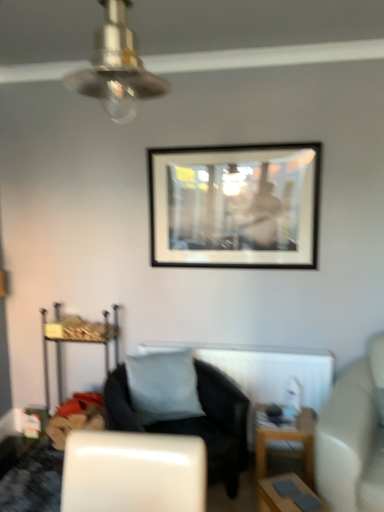
Question: Considering the relative sizes of metallic silver ceiling fan at upper center and black fabric chair at center in the image provided, is metallic silver ceiling fan at upper center shorter than black fabric chair at center?

Choices:
 (A) yes
 (B) no

Answer: (A)

Question: From a real-world perspective, is metallic silver ceiling fan at upper center physically above black fabric chair at center?

Choices:
 (A) yes
 (B) no

Answer: (A)

Question: Does metallic silver ceiling fan at upper center appear on the right side of black fabric chair at center?

Choices:
 (A) yes
 (B) no

Answer: (B)

Question: Does metallic silver ceiling fan at upper center have a lesser width compared to black fabric chair at center?

Choices:
 (A) no
 (B) yes

Answer: (B)

Question: Can black fabric chair at center be found inside metallic silver ceiling fan at upper center?

Choices:
 (A) no
 (B) yes

Answer: (A)

Question: In the image, is smooth wooden table at lower right, the second table when ordered from back to front, on the left side or the right side of black fabric chair at center?

Choices:
 (A) left
 (B) right

Answer: (B)

Question: From their relative heights in the image, would you say smooth wooden table at lower right, the 1th table in the front-to-back sequence, is taller or shorter than black fabric chair at center?

Choices:
 (A) short
 (B) tall

Answer: (A)

Question: From the image's perspective, is smooth wooden table at lower right, the second table when ordered from back to front, positioned above or below black fabric chair at center?

Choices:
 (A) below
 (B) above

Answer: (A)

Question: Based on their sizes in the image, would you say smooth wooden table at lower right, the second table when ordered from back to front, is bigger or smaller than black fabric chair at center?

Choices:
 (A) big
 (B) small

Answer: (B)

Question: Would you say smooth wooden table at lower right, the second table when ordered from back to front, is to the left or to the right of white leather couch at right in the picture?

Choices:
 (A) right
 (B) left

Answer: (B)

Question: From the image's perspective, is smooth wooden table at lower right, the second table when ordered from back to front, located above or below white leather couch at right?

Choices:
 (A) above
 (B) below

Answer: (B)

Question: Do you think smooth wooden table at lower right, the second table when ordered from back to front, is within white leather couch at right, or outside of it?

Choices:
 (A) outside
 (B) inside

Answer: (A)

Question: Is smooth wooden table at lower right, the 1th table in the front-to-back sequence, in front of or behind white leather couch at right in the image?

Choices:
 (A) behind
 (B) front

Answer: (A)

Question: From a real-world perspective, is black matte picture frame at upper center physically located above or below white matte radiator at center?

Choices:
 (A) above
 (B) below

Answer: (A)

Question: Looking at the image, does black matte picture frame at upper center seem bigger or smaller compared to white matte radiator at center?

Choices:
 (A) small
 (B) big

Answer: (A)